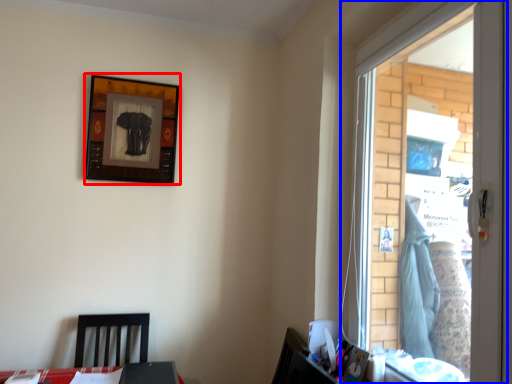
Question: Which object appears closest to the camera in this image, picture frame (highlighted by a red box) or window (highlighted by a blue box)?

Choices:
 (A) picture frame
 (B) window

Answer: (B)